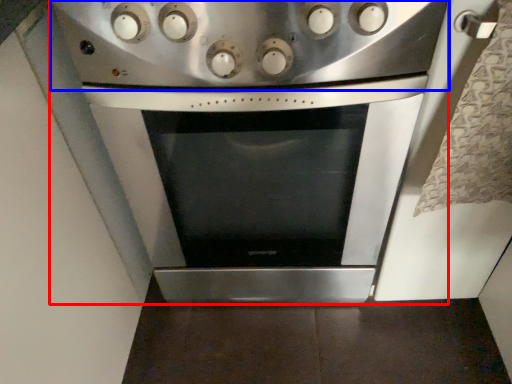
Question: Which object is closer to the camera taking this photo, kitchen appliance (highlighted by a red box) or gas stove (highlighted by a blue box)?

Choices:
 (A) kitchen appliance
 (B) gas stove

Answer: (B)